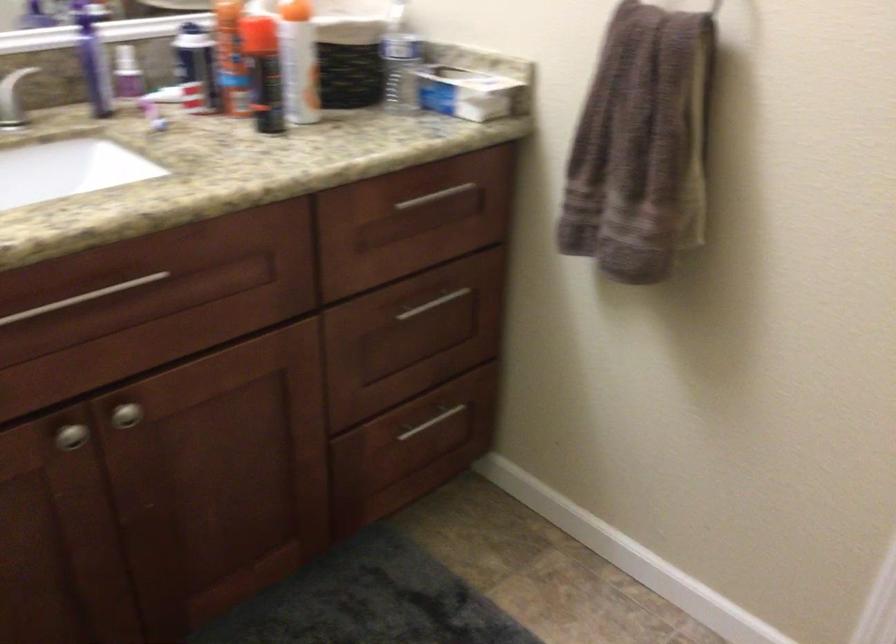
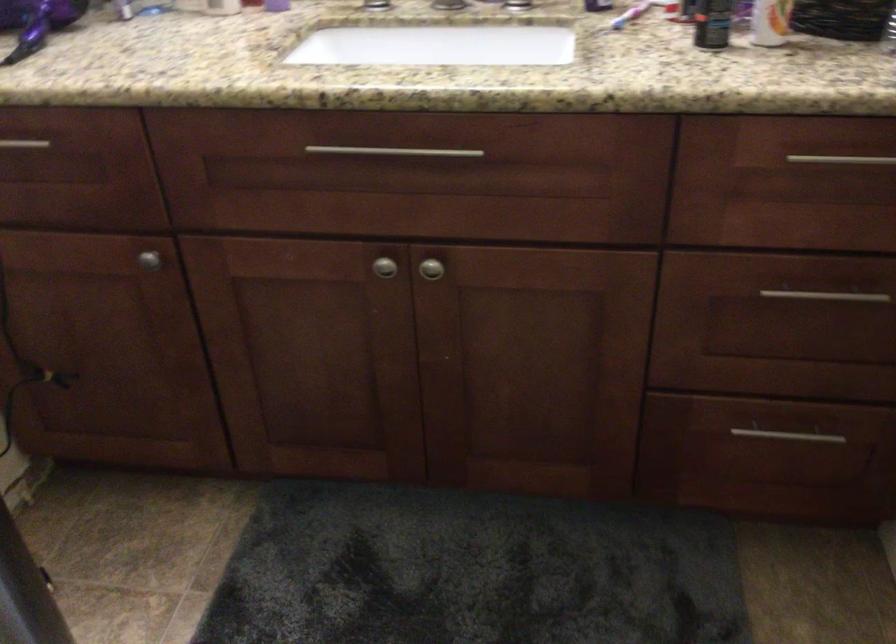
Locate, in the second image, the point that corresponds to [286,111] in the first image.

(712, 23)